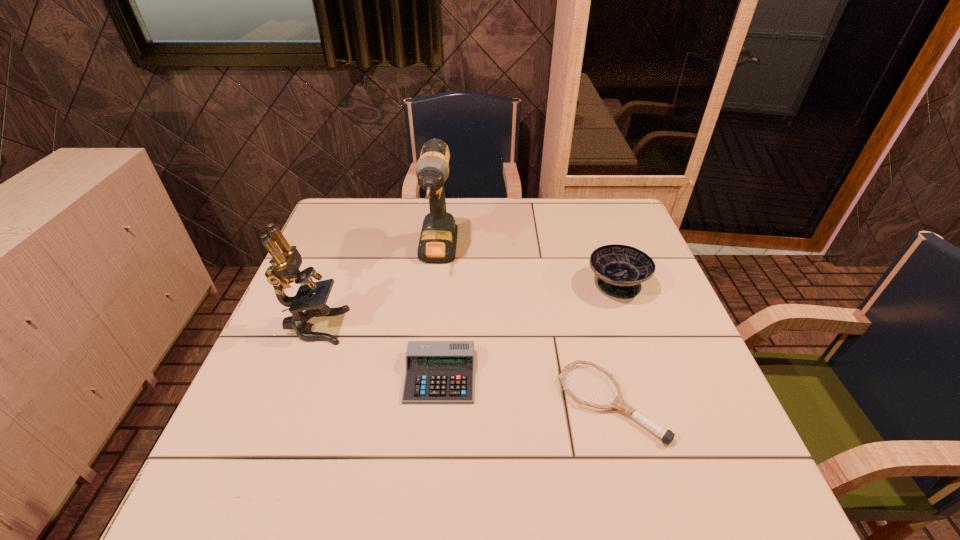
Locate an element on the screen. The width and height of the screenshot is (960, 540). drill is located at coordinates (438, 239).

Locate an element on the screen. This screenshot has width=960, height=540. microscope is located at coordinates (285, 266).

At what (x,y) coordinates should I click in order to perform the action: click on the leftmost object. Please return your answer as a coordinate pair (x, y). The height and width of the screenshot is (540, 960). Looking at the image, I should click on (285, 266).

Where is `bowl`? bowl is located at coordinates (621, 269).

What are the coordinates of `the fourth tallest object` in the screenshot? It's located at (437, 372).

Where is `tennis racket`? tennis racket is located at coordinates (667, 436).

Image resolution: width=960 pixels, height=540 pixels. Identify the location of vacant space located with the drill bit of the drill facing forward. (426, 356).

Find the location of a particular element. The width and height of the screenshot is (960, 540). free space located at the eyepieces of the third farthest object is located at coordinates (386, 326).

Find the location of a particular element. The image size is (960, 540). vacant space situated on the left of the bowl is located at coordinates (567, 284).

Find the location of `free space located on the left of the second shortest object`. free space located on the left of the second shortest object is located at coordinates (251, 376).